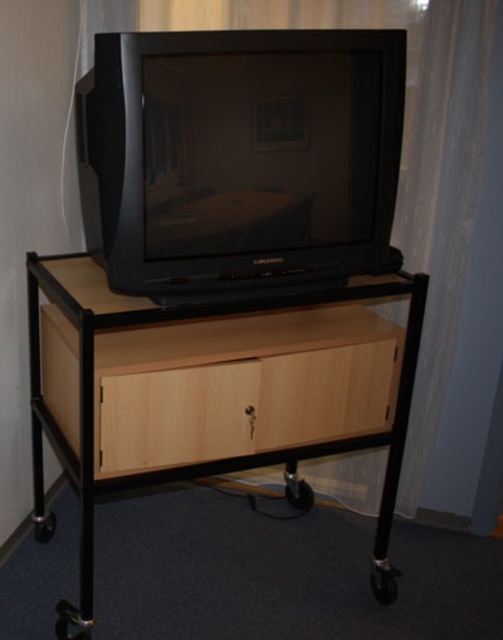
Question: Among these objects, which one is nearest to the camera?

Choices:
 (A) white sheer curtain at upper center
 (B) light wood/wooden drawer at center
 (C) light wood/black metal table at center
 (D) black plastic television at center

Answer: (D)

Question: Is black plastic television at center to the left of light wood/wooden drawer at center from the viewer's perspective?

Choices:
 (A) yes
 (B) no

Answer: (A)

Question: Is the position of light wood/black metal table at center more distant than that of white sheer curtain at upper center?

Choices:
 (A) yes
 (B) no

Answer: (B)

Question: Among these objects, which one is farthest from the camera?

Choices:
 (A) light wood/black metal table at center
 (B) black plastic television at center
 (C) white sheer curtain at upper center
 (D) light wood/wooden drawer at center

Answer: (C)

Question: Which of the following is the closest to the observer?

Choices:
 (A) (266, 250)
 (B) (259, 428)
 (C) (461, 337)
 (D) (33, 268)

Answer: (A)

Question: Is light wood/black metal table at center to the left of white sheer curtain at upper center from the viewer's perspective?

Choices:
 (A) yes
 (B) no

Answer: (A)